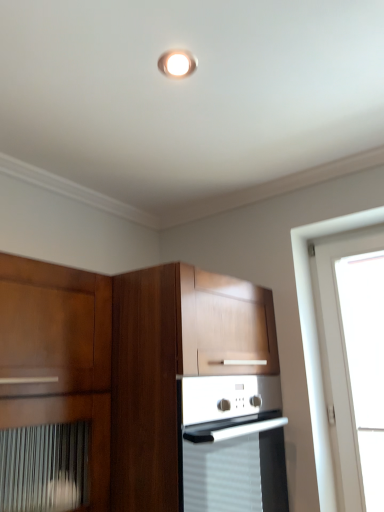
Question: Is matte white light fixture at upper center bigger or smaller than wooden cabinet at center?

Choices:
 (A) big
 (B) small

Answer: (B)

Question: Is matte white light fixture at upper center wider or thinner than wooden cabinet at center?

Choices:
 (A) thin
 (B) wide

Answer: (A)

Question: Does point (163, 70) appear closer or farther from the camera than point (225, 436)?

Choices:
 (A) farther
 (B) closer

Answer: (B)

Question: Is wooden cabinet at center spatially inside matte white light fixture at upper center, or outside of it?

Choices:
 (A) outside
 (B) inside

Answer: (A)

Question: Considering the positions of point (187, 333) and point (183, 72), is point (187, 333) closer or farther from the camera than point (183, 72)?

Choices:
 (A) closer
 (B) farther

Answer: (B)

Question: From their relative heights in the image, would you say wooden cabinet at center is taller or shorter than matte white light fixture at upper center?

Choices:
 (A) tall
 (B) short

Answer: (A)

Question: From the image's perspective, is wooden cabinet at center located above or below matte white light fixture at upper center?

Choices:
 (A) below
 (B) above

Answer: (A)